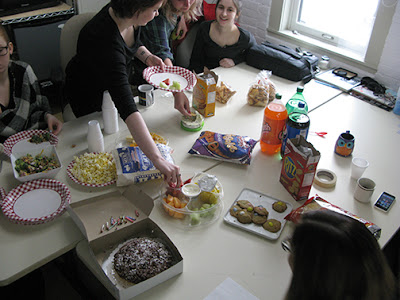
This screenshot has width=400, height=300. Find the location of `window`. window is located at coordinates coord(339,18).